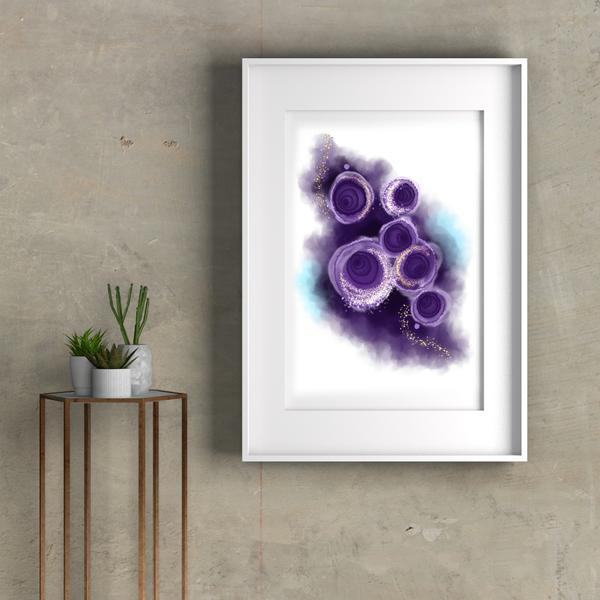
At what (x,y) coordinates should I click in order to perform the action: click on plant stand. Please return your answer as a coordinate pair (x, y). This screenshot has width=600, height=600. Looking at the image, I should click on (155, 397).